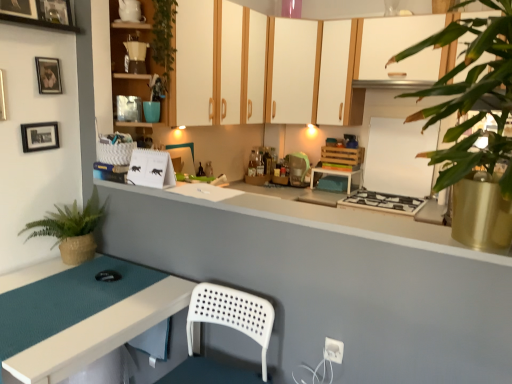
Question: Is the depth of teal matte table at lower left, the 1th table in the left-to-right sequence, greater than that of teal glass jar at upper center?

Choices:
 (A) no
 (B) yes

Answer: (A)

Question: Does teal matte table at lower left, which ranks as the second table in right-to-left order, have a larger size compared to teal glass jar at upper center?

Choices:
 (A) yes
 (B) no

Answer: (A)

Question: Can you confirm if teal matte table at lower left, the 1th table positioned from the front, is thinner than teal glass jar at upper center?

Choices:
 (A) no
 (B) yes

Answer: (A)

Question: Is teal matte table at lower left, which appears as the second table when viewed from the top, taller than teal glass jar at upper center?

Choices:
 (A) no
 (B) yes

Answer: (B)

Question: From a real-world perspective, is teal matte table at lower left, the 1th table positioned from the front, on teal glass jar at upper center?

Choices:
 (A) yes
 (B) no

Answer: (B)

Question: Would you say braided straw pot at left, which is the second houseplant from right to left, is inside or outside matte yellow coffee maker at upper center?

Choices:
 (A) inside
 (B) outside

Answer: (B)

Question: Based on their positions, is braided straw pot at left, which is the 1th houseplant in back-to-front order, located to the left or right of matte yellow coffee maker at upper center?

Choices:
 (A) right
 (B) left

Answer: (B)

Question: In the image, is braided straw pot at left, the 1th houseplant when ordered from left to right, positioned in front of or behind matte yellow coffee maker at upper center?

Choices:
 (A) front
 (B) behind

Answer: (A)

Question: Considering the positions of braided straw pot at left, which is the second houseplant from right to left, and matte yellow coffee maker at upper center in the image, is braided straw pot at left, which is the second houseplant from right to left, taller or shorter than matte yellow coffee maker at upper center?

Choices:
 (A) short
 (B) tall

Answer: (B)

Question: Is matte yellow coffee maker at upper center taller or shorter than white matte cabinet at upper center, the second cabinetry from the right?

Choices:
 (A) short
 (B) tall

Answer: (A)

Question: Would you say matte yellow coffee maker at upper center is inside or outside white matte cabinet at upper center, the second cabinetry in the back-to-front sequence?

Choices:
 (A) outside
 (B) inside

Answer: (A)

Question: Does point (135, 36) appear closer or farther from the camera than point (291, 82)?

Choices:
 (A) farther
 (B) closer

Answer: (B)

Question: Is matte yellow coffee maker at upper center to the left or to the right of white matte cabinet at upper center, the 2th cabinetry when ordered from front to back, in the image?

Choices:
 (A) right
 (B) left

Answer: (B)

Question: From a real-world perspective, is wooden picture frame at upper left, which appears as the 1th picture frame when viewed from the top, physically located above or below white matte cabinet at upper center, marked as the second cabinetry in a left-to-right arrangement?

Choices:
 (A) above
 (B) below

Answer: (A)

Question: Is point (24, 1) positioned closer to the camera than point (283, 69)?

Choices:
 (A) farther
 (B) closer

Answer: (B)